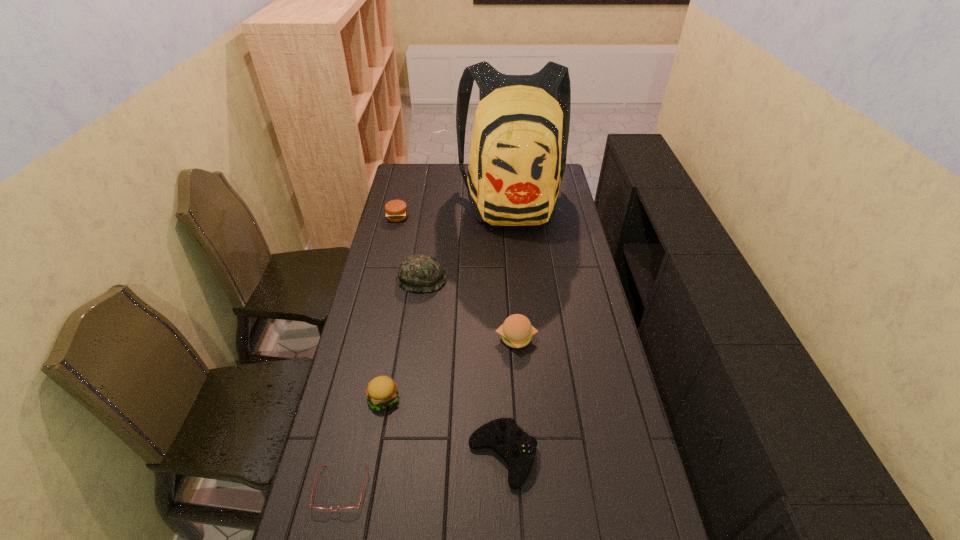
Find the location of `free space located 0.090m on the right of the fourth nearest object`. free space located 0.090m on the right of the fourth nearest object is located at coordinates (564, 338).

Locate an element on the screen. blank area located on the back of the farthest hamburger is located at coordinates (408, 171).

I want to click on vacant space located 0.270m on the back of the nearest hamburger, so click(397, 318).

Find the location of a particular element. This screenshot has height=540, width=960. vacant space situated on the left of the control is located at coordinates (431, 456).

The width and height of the screenshot is (960, 540). I want to click on object that is at the far edge, so click(x=518, y=151).

Identify the location of headwear situated at the left edge. pos(418,273).

You are a GUI agent. You are given a task and a screenshot of the screen. Output one action in this format:
    pyautogui.click(x=<x>, y=<y>)
    Task: Click on the spectacles located in the left edge section of the desktop
    This screenshot has width=960, height=540.
    Given the screenshot: What is the action you would take?
    pyautogui.click(x=348, y=509)

At what (x,y) coordinates should I click in order to perform the action: click on object situated at the right edge. Please return your answer as a coordinate pair (x, y). Looking at the image, I should click on (518, 151).

I want to click on object at the far right corner, so click(x=518, y=151).

At what (x,y) coordinates should I click in order to perform the action: click on vacant space at the far edge of the desktop. Please return your answer as a coordinate pair (x, y). This screenshot has width=960, height=540. Looking at the image, I should click on (457, 172).